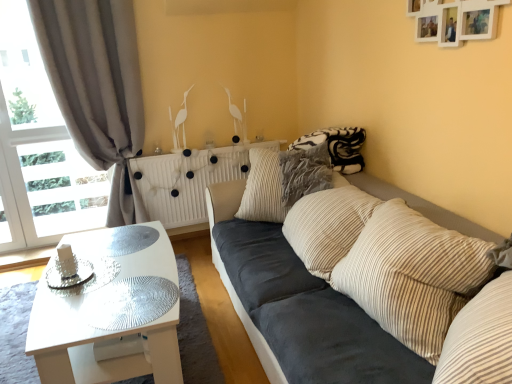
Find the location of a particular element. The height and width of the screenshot is (384, 512). empty space that is ontop of transparent glass table at lower left (from a real-world perspective) is located at coordinates (125, 297).